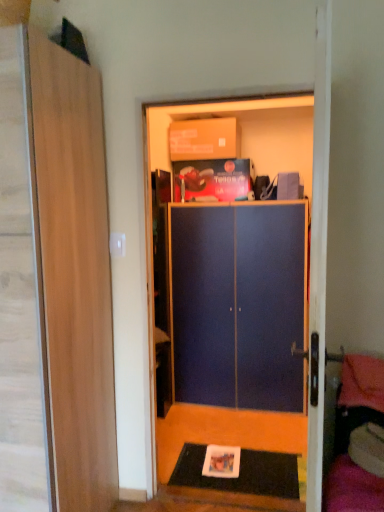
Question: Is black rubber doormat at lower center not close to blue matte cabinet at center?

Choices:
 (A) yes
 (B) no

Answer: (A)

Question: Does black rubber doormat at lower center have a lesser height compared to blue matte cabinet at center?

Choices:
 (A) no
 (B) yes

Answer: (B)

Question: Considering the relative sizes of black rubber doormat at lower center and blue matte cabinet at center in the image provided, is black rubber doormat at lower center smaller than blue matte cabinet at center?

Choices:
 (A) no
 (B) yes

Answer: (B)

Question: Considering the relative positions of black rubber doormat at lower center and blue matte cabinet at center in the image provided, is black rubber doormat at lower center to the right of blue matte cabinet at center from the viewer's perspective?

Choices:
 (A) yes
 (B) no

Answer: (A)

Question: Is black rubber doormat at lower center positioned with its back to blue matte cabinet at center?

Choices:
 (A) no
 (B) yes

Answer: (A)

Question: Would you say black rubber doormat at lower center contains blue matte cabinet at center?

Choices:
 (A) yes
 (B) no

Answer: (B)

Question: From the image's perspective, does wooden door at left appear higher than blue matte cabinet at center?

Choices:
 (A) no
 (B) yes

Answer: (B)

Question: From a real-world perspective, is wooden door at left beneath blue matte cabinet at center?

Choices:
 (A) no
 (B) yes

Answer: (A)

Question: Does wooden door at left appear on the right side of blue matte cabinet at center?

Choices:
 (A) yes
 (B) no

Answer: (B)

Question: Is wooden door at left next to blue matte cabinet at center and touching it?

Choices:
 (A) no
 (B) yes

Answer: (A)

Question: Is wooden door at left thinner than blue matte cabinet at center?

Choices:
 (A) no
 (B) yes

Answer: (A)

Question: Is wooden door at left not near blue matte cabinet at center?

Choices:
 (A) no
 (B) yes

Answer: (B)

Question: Does blue matte cabinet at center come behind matte cardboard box at upper center?

Choices:
 (A) no
 (B) yes

Answer: (A)